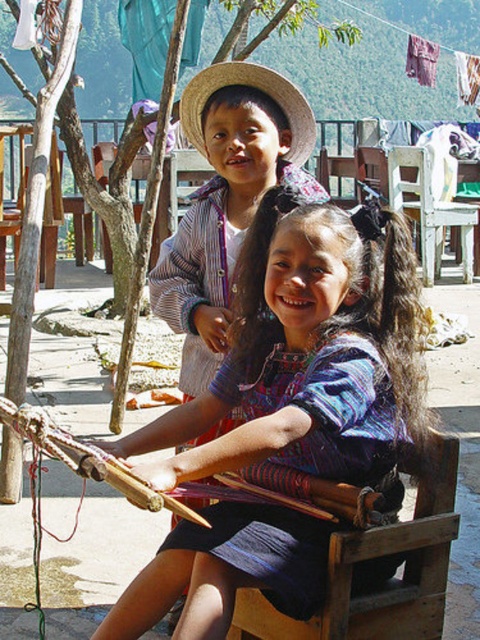
You are a photographer standing at the camera position. You want to take a closeup shot of the blue woven fabric at center. Can you reach it without moving from your current position?

The blue woven fabric at center is 2.45 meters away from the camera. If you can extend your camera lens or move closer within your current position, you might be able to capture a closeup. However, if you must stay exactly where you are without any adjustments, the distance may make it challenging to get a clear closeup without additional equipment.

You are a visitor observing the weaving activity and need to know which object is wider between the blue woven fabric at center and the wooden chair at lower center. Can you determine this?

The blue woven fabric at center is wider than the wooden chair at lower center.

What is the location of the blue woven fabric at center in the image?

The blue woven fabric at center is located at point (308,356) in the image.